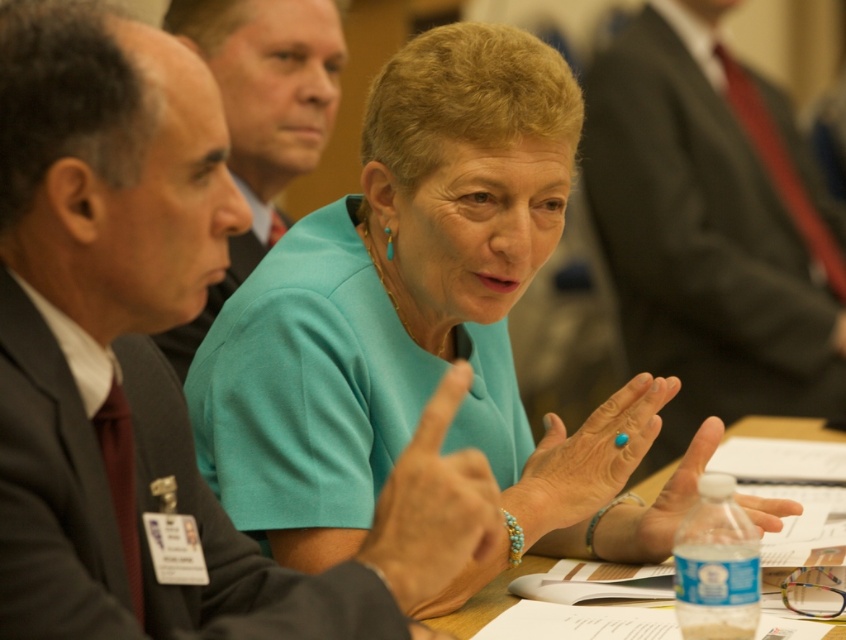
In the formal meeting scene, you notice two central figures wearing the teal fabric blouse at center and the matte black suit at center. Which of these two items is positioned higher up in the image?

The teal fabric blouse at center is located above the matte black suit at center in the image.

You are organizing a charity event and need to arrange seating for two guests wearing matte black suits. The first guest is wearing the matte black suit at center, and the second guest is wearing the matte black suit at left. Based on their attire, which guest do you think requires a larger seating space?

The matte black suit at left is larger in size compared to the matte black suit at center, so the guest wearing the matte black suit at left would require a larger seating space.

You are a photographer trying to capture a clear shot of both the matte black suit at center and the matte black suit at left. Since both are wearing similar attire, how can you distinguish which one is closer to the camera?

The matte black suit at center is in front of the matte black suit at left, so the one at center will appear closer to the camera due to its positioning in front.